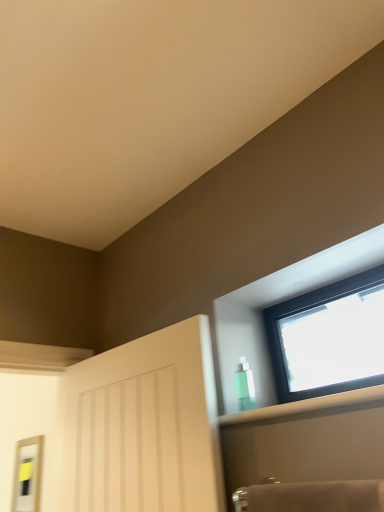
Describe the element at coordinates (328, 338) in the screenshot. This screenshot has width=384, height=512. I see `transparent glass window at upper right` at that location.

What is the approximate width of transparent glass window at upper right?

transparent glass window at upper right is 0.85 inches in width.

At what (x,y) coordinates should I click in order to perform the action: click on green translucent bottle at upper right. Please return your answer as a coordinate pair (x, y). Image resolution: width=384 pixels, height=512 pixels. Looking at the image, I should click on (245, 385).

Consider the image. What is the approximate height of green translucent bottle at upper right?

green translucent bottle at upper right is 6.22 inches in height.

The width and height of the screenshot is (384, 512). Identify the location of transparent plastic bottle at upper right. (305, 406).

Is there a large distance between matte silver mirror at left and transparent glass window at upper right?

Absolutely, matte silver mirror at left is distant from transparent glass window at upper right.

Is point (27, 458) positioned after point (367, 325)?

Yes, point (27, 458) is farther from viewer.

At what (x,y) coordinates should I click in order to perform the action: click on window on the right of matte silver mirror at left. Please return your answer as a coordinate pair (x, y). The height and width of the screenshot is (512, 384). Looking at the image, I should click on (328, 338).

Is matte silver mirror at left turned away from transparent glass window at upper right?

matte silver mirror at left is not turned away from transparent glass window at upper right.

From the image's perspective, is transparent plastic bottle at upper right above or below transparent glass window at upper right?

From the image's perspective, transparent plastic bottle at upper right appears below transparent glass window at upper right.

In the scene shown: Is transparent plastic bottle at upper right facing away from transparent glass window at upper right?

No, transparent plastic bottle at upper right is not facing away from transparent glass window at upper right.

Is point (267, 412) positioned before point (340, 294)?

That is True.

Does transparent glass window at upper right have a smaller size compared to transparent plastic bottle at upper right?

Correct, transparent glass window at upper right occupies less space than transparent plastic bottle at upper right.

Is transparent glass window at upper right next to transparent plastic bottle at upper right and touching it?

transparent glass window at upper right and transparent plastic bottle at upper right are not in contact.

Does transparent glass window at upper right come behind transparent plastic bottle at upper right?

Yes, it is behind transparent plastic bottle at upper right.

How different are the orientations of transparent glass window at upper right and transparent plastic bottle at upper right in degrees?

The angular difference between transparent glass window at upper right and transparent plastic bottle at upper right is 0.481 degrees.

Between transparent glass window at upper right and green translucent bottle at upper right, which one has more height?

transparent glass window at upper right is taller.

Is transparent glass window at upper right to the right of green translucent bottle at upper right from the viewer's perspective?

Indeed, transparent glass window at upper right is positioned on the right side of green translucent bottle at upper right.

Which object is wider, transparent glass window at upper right or green translucent bottle at upper right?

Wider between the two is green translucent bottle at upper right.

How different are the orientations of transparent glass window at upper right and green translucent bottle at upper right in degrees?

transparent glass window at upper right and green translucent bottle at upper right are facing 4.06 degrees away from each other.

Would you say transparent plastic bottle at upper right contains matte silver mirror at left?

That's incorrect, matte silver mirror at left is not inside transparent plastic bottle at upper right.

From the image's perspective, which one is positioned higher, transparent plastic bottle at upper right or matte silver mirror at left?

transparent plastic bottle at upper right.

Is transparent plastic bottle at upper right aimed at matte silver mirror at left?

No.

From a real-world perspective, relative to matte silver mirror at left, is transparent plastic bottle at upper right vertically above or below?

transparent plastic bottle at upper right is situated higher than matte silver mirror at left in the real world.

Considering the sizes of objects transparent glass window at upper right and matte silver mirror at left in the image provided, who is wider, transparent glass window at upper right or matte silver mirror at left?

With larger width is matte silver mirror at left.

Would you say transparent glass window at upper right is a long distance from matte silver mirror at left?

Yes, transparent glass window at upper right is far from matte silver mirror at left.

You are a GUI agent. You are given a task and a screenshot of the screen. Output one action in this format:
    pyautogui.click(x=<x>, y=<y>)
    Task: Click on the window that appears above the matte silver mirror at left (from the image's perspective)
    This screenshot has height=512, width=384.
    Given the screenshot: What is the action you would take?
    pyautogui.click(x=328, y=338)

Is transparent glass window at upper right situated inside matte silver mirror at left or outside?

transparent glass window at upper right lies outside matte silver mirror at left.

Looking at this image, how many degrees apart are the facing directions of transparent plastic bottle at upper right and green translucent bottle at upper right?

There is a 3.58-degree angle between the facing directions of transparent plastic bottle at upper right and green translucent bottle at upper right.

Locate an element on the screen. Image resolution: width=384 pixels, height=512 pixels. shelf lying on the right of green translucent bottle at upper right is located at coordinates (305, 406).

Choose the correct answer: Is transparent plastic bottle at upper right inside green translucent bottle at upper right or outside it?

transparent plastic bottle at upper right cannot be found inside green translucent bottle at upper right.

Does transparent plastic bottle at upper right touch green translucent bottle at upper right?

No, transparent plastic bottle at upper right is not touching green translucent bottle at upper right.

At what (x,y) coordinates should I click in order to perform the action: click on mirror behind the transparent glass window at upper right. Please return your answer as a coordinate pair (x, y). Looking at the image, I should click on (27, 475).

I want to click on shelf in front of the transparent glass window at upper right, so click(305, 406).

Based on their spatial positions, is transparent glass window at upper right or transparent plastic bottle at upper right closer to green translucent bottle at upper right?

transparent plastic bottle at upper right lies closer to green translucent bottle at upper right than the other object.

When comparing their distances from transparent plastic bottle at upper right, does transparent glass window at upper right or matte silver mirror at left seem closer?

Based on the image, transparent glass window at upper right appears to be nearer to transparent plastic bottle at upper right.

In the scene shown: Based on their spatial positions, is transparent plastic bottle at upper right or green translucent bottle at upper right closer to matte silver mirror at left?

green translucent bottle at upper right is positioned closer to the anchor matte silver mirror at left.

Based on their spatial positions, is transparent plastic bottle at upper right or green translucent bottle at upper right further from transparent glass window at upper right?

transparent plastic bottle at upper right is positioned further to the anchor transparent glass window at upper right.

From the image, which object appears to be farther from transparent glass window at upper right, matte silver mirror at left or transparent plastic bottle at upper right?

Based on the image, matte silver mirror at left appears to be further to transparent glass window at upper right.

From the picture: Estimate the real-world distances between objects in this image. Which object is further from transparent plastic bottle at upper right, matte silver mirror at left or transparent glass window at upper right?

matte silver mirror at left.

When comparing their distances from transparent glass window at upper right, does transparent plastic bottle at upper right or matte silver mirror at left seem closer?

transparent plastic bottle at upper right lies closer to transparent glass window at upper right than the other object.

From the image, which object appears to be nearer to matte silver mirror at left, transparent plastic bottle at upper right or transparent glass window at upper right?

transparent plastic bottle at upper right lies closer to matte silver mirror at left than the other object.

Image resolution: width=384 pixels, height=512 pixels. I want to click on toiletry located between matte silver mirror at left and transparent glass window at upper right in the left-right direction, so click(x=245, y=385).

At what (x,y) coordinates should I click in order to perform the action: click on toiletry between matte silver mirror at left and transparent plastic bottle at upper right in the horizontal direction. Please return your answer as a coordinate pair (x, y). The image size is (384, 512). Looking at the image, I should click on (245, 385).

Locate an element on the screen. shelf between matte silver mirror at left and transparent glass window at upper right is located at coordinates (305, 406).

Locate an element on the screen. The width and height of the screenshot is (384, 512). window positioned between transparent plastic bottle at upper right and green translucent bottle at upper right from near to far is located at coordinates (328, 338).